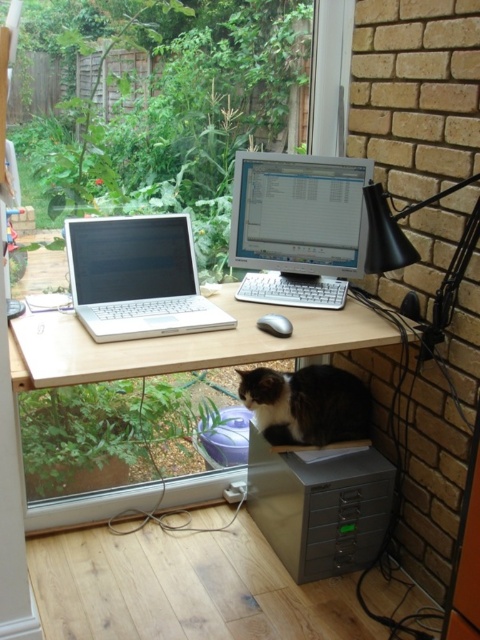
How far apart are white wooden computer desk at center and fluffy black-and-white cat at center?

white wooden computer desk at center is 14.08 inches from fluffy black-and-white cat at center.

Based on the photo, between white wooden computer desk at center and fluffy black-and-white cat at center, which one is positioned higher?

white wooden computer desk at center is above.

Is point (137, 356) closer to viewer compared to point (322, 438)?

Yes, point (137, 356) is in front of point (322, 438).

Locate an element on the screen. The width and height of the screenshot is (480, 640). white wooden computer desk at center is located at coordinates (182, 344).

Does point (228, 307) lie behind point (348, 540)?

That is False.

Is point (217, 365) farther from camera compared to point (372, 554)?

That is False.

At what (x,y) coordinates should I click in order to perform the action: click on transparent glass window at upper center. Please return your answer as a coordinate pair (x, y). Looking at the image, I should click on (168, 344).

Can you confirm if white wooden computer desk at center is positioned to the left of transparent glass window at upper center?

Incorrect, white wooden computer desk at center is not on the left side of transparent glass window at upper center.

Who is positioned more to the left, white wooden computer desk at center or transparent glass window at upper center?

From the viewer's perspective, transparent glass window at upper center appears more on the left side.

Image resolution: width=480 pixels, height=640 pixels. What are the coordinates of `white wooden computer desk at center` in the screenshot? It's located at (182, 344).

Identify the location of white wooden computer desk at center. This screenshot has width=480, height=640. (182, 344).